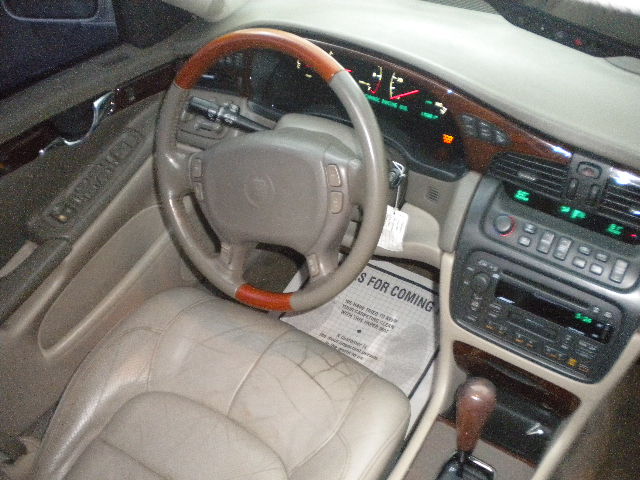
This screenshot has width=640, height=480. Identify the location of metal handle. (97, 111).